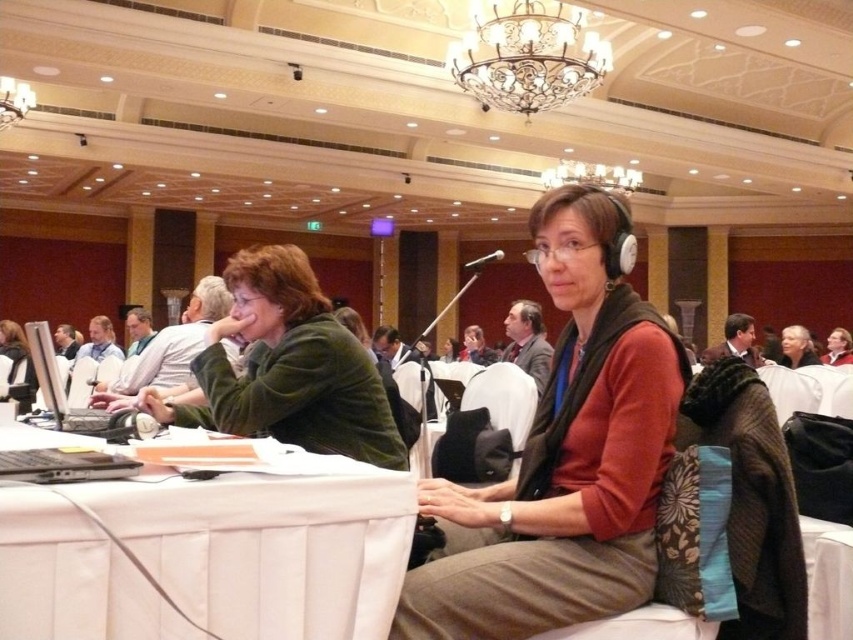
You are organizing a presentation and need to ensure that the microphone stand can reach the metallic gold chandelier at upper center and the black matte laptop at left. Which object requires a taller microphone stand?

The metallic gold chandelier at upper center requires a taller microphone stand because it has a greater height compared to the black matte laptop at left.

You are organizing a photo shoot and need to ensure that the green fuzzy sweater at center and the black matte laptop at left are both visible in the frame. Based on their sizes, which object might require more space in the frame?

The green fuzzy sweater at center might require more space in the frame since it is wider than the black matte laptop at left.

You are organizing a conference and need to place a 36 inch wide banner between the white fabric table at lower left and the black matte laptop at left. Will the banner fit in the space between them?

The distance between the white fabric table at lower left and the black matte laptop at left is 36.25 inches, so a 36 inch wide banner will fit with a small amount of space remaining.